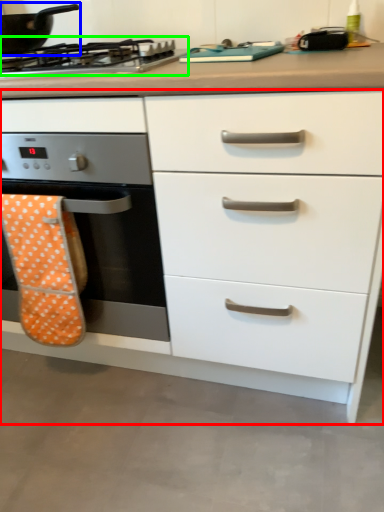
Question: Which object is positioned farthest from chest of drawers (highlighted by a red box)? Select from kitchen appliance (highlighted by a blue box) and gas stove (highlighted by a green box).

Choices:
 (A) kitchen appliance
 (B) gas stove

Answer: (A)